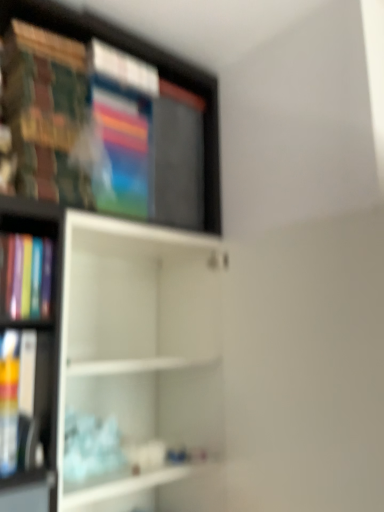
Question: Is wooden bookshelf at upper left, arranged as the second shelf when ordered from the bottom, located outside matte plastic book at left?

Choices:
 (A) no
 (B) yes

Answer: (B)

Question: From a real-world perspective, is wooden bookshelf at upper left, which is counted as the first shelf, starting from the top, positioned over matte plastic book at left based on gravity?

Choices:
 (A) no
 (B) yes

Answer: (B)

Question: Could you tell me if wooden bookshelf at upper left, arranged as the second shelf when ordered from the bottom, is turned towards matte plastic book at left?

Choices:
 (A) no
 (B) yes

Answer: (A)

Question: Does wooden bookshelf at upper left, which is counted as the first shelf, starting from the top, appear on the left side of matte plastic book at left?

Choices:
 (A) no
 (B) yes

Answer: (A)

Question: Can you confirm if wooden bookshelf at upper left, which is counted as the first shelf, starting from the top, is bigger than matte plastic book at left?

Choices:
 (A) no
 (B) yes

Answer: (B)

Question: Is point (36, 16) positioned closer to the camera than point (160, 426)?

Choices:
 (A) farther
 (B) closer

Answer: (B)

Question: Considering their positions, is wooden bookshelf at upper left, which is counted as the first shelf, starting from the top, located in front of or behind white matte shelf at center, the first shelf ordered from the bottom?

Choices:
 (A) front
 (B) behind

Answer: (B)

Question: Considering the positions of wooden bookshelf at upper left, which is counted as the first shelf, starting from the top, and white matte shelf at center, arranged as the second shelf when viewed from the top, in the image, is wooden bookshelf at upper left, which is counted as the first shelf, starting from the top, wider or thinner than white matte shelf at center, arranged as the second shelf when viewed from the top,?

Choices:
 (A) wide
 (B) thin

Answer: (B)

Question: From a real-world perspective, is wooden bookshelf at upper left, which is counted as the first shelf, starting from the top, above or below white matte shelf at center, the first shelf ordered from the bottom?

Choices:
 (A) below
 (B) above

Answer: (B)

Question: Looking at their shapes, would you say white matte shelf at center, arranged as the second shelf when viewed from the top, is wider or thinner than wooden bookshelf at upper left, which is counted as the first shelf, starting from the top?

Choices:
 (A) wide
 (B) thin

Answer: (A)

Question: Is white matte shelf at center, arranged as the second shelf when viewed from the top, taller or shorter than wooden bookshelf at upper left, arranged as the second shelf when ordered from the bottom?

Choices:
 (A) tall
 (B) short

Answer: (A)

Question: Is white matte shelf at center, the first shelf ordered from the bottom, in front of or behind wooden bookshelf at upper left, arranged as the second shelf when ordered from the bottom, in the image?

Choices:
 (A) front
 (B) behind

Answer: (A)

Question: Looking at the image, does white matte shelf at center, the first shelf ordered from the bottom, seem bigger or smaller compared to wooden bookshelf at upper left, which is counted as the first shelf, starting from the top?

Choices:
 (A) small
 (B) big

Answer: (B)

Question: Based on their sizes in the image, would you say matte plastic book at left is bigger or smaller than white matte shelf at center, the first shelf ordered from the bottom?

Choices:
 (A) big
 (B) small

Answer: (B)

Question: Considering the positions of matte plastic book at left and white matte shelf at center, arranged as the second shelf when viewed from the top, in the image, is matte plastic book at left wider or thinner than white matte shelf at center, arranged as the second shelf when viewed from the top,?

Choices:
 (A) thin
 (B) wide

Answer: (A)